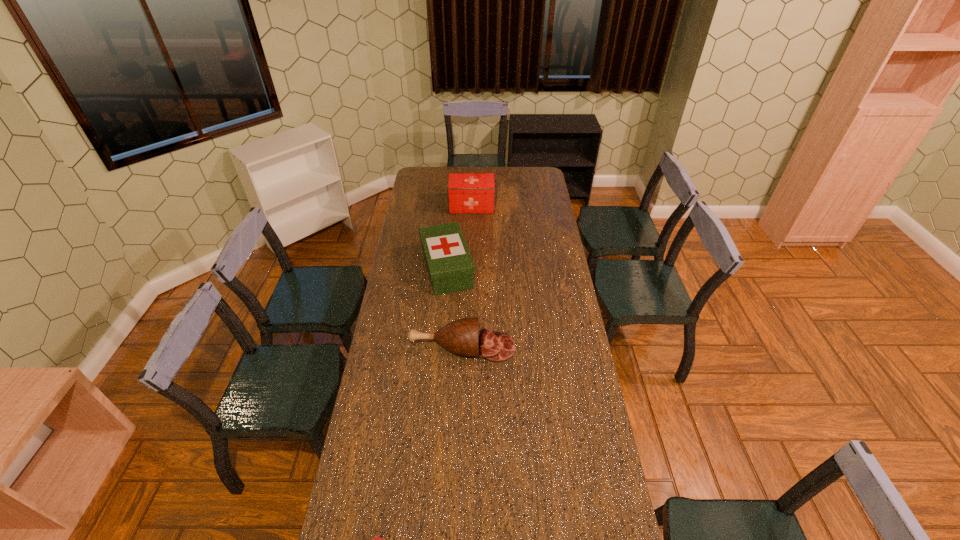
The height and width of the screenshot is (540, 960). In the image, there is a desktop. In order to click on free space at the far edge in this screenshot , I will do `click(518, 185)`.

Where is `vacant space at the left edge of the desktop`? This screenshot has height=540, width=960. vacant space at the left edge of the desktop is located at coordinates (392, 465).

In the image, there is a desktop. Identify the location of free space at the right edge. (573, 346).

Where is `free space at the far left corner of the desktop`? The image size is (960, 540). free space at the far left corner of the desktop is located at coordinates tap(421, 183).

At what (x,y) coordinates should I click in order to perform the action: click on free location at the far right corner. Please return your answer as a coordinate pair (x, y). This screenshot has width=960, height=540. Looking at the image, I should click on 540,180.

I want to click on free point between the ham and the third nearest object, so click(455, 308).

At what (x,y) coordinates should I click in order to perform the action: click on vacant area that lies between the third farthest object and the second tallest first-aid kit. Please return your answer as a coordinate pair (x, y). Image resolution: width=960 pixels, height=540 pixels. Looking at the image, I should click on (455, 308).

Identify the location of unoccupied area between the second tallest first-aid kit and the third farthest object. (455, 308).

Where is `object that is the second closest to the nearest first-aid kit`? object that is the second closest to the nearest first-aid kit is located at coordinates (450, 266).

What are the coordinates of `object that can be found as the closest to the third nearest object` in the screenshot? It's located at (460, 336).